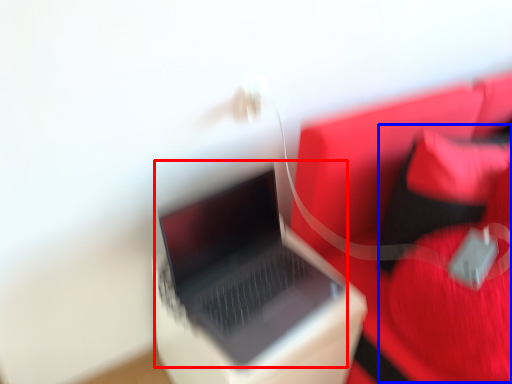
Question: Which of the following is the closest to the observer, laptop (highlighted by a red box) or bean bag chair (highlighted by a blue box)?

Choices:
 (A) laptop
 (B) bean bag chair

Answer: (B)